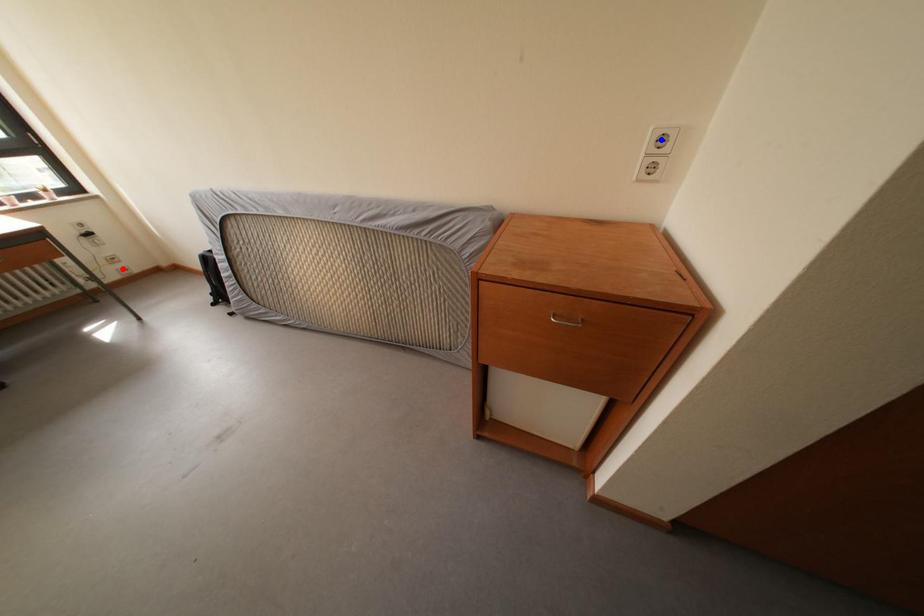
Question: In the image, two points are highlighted. Which point is nearer to the camera? Reply with the corresponding letter.

Choices:
 (A) blue point
 (B) red point

Answer: (A)